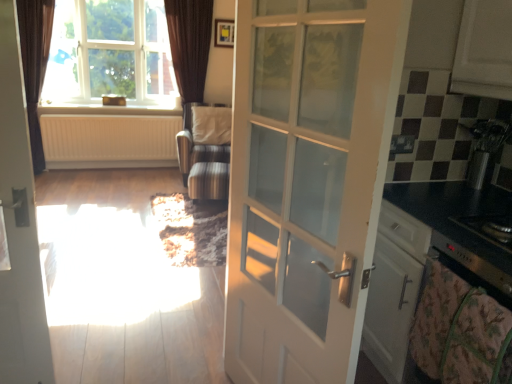
Measure the distance between white glossy door at left, the 1th door in the left-to-right sequence, and camera.

The depth of white glossy door at left, the 1th door in the left-to-right sequence, is 4.37 feet.

What do you see at coordinates (19, 227) in the screenshot? This screenshot has width=512, height=384. I see `white glossy door at left, placed as the 2th door when sorted from right to left` at bounding box center [19, 227].

Measure the distance between striped fabric armchair at center and camera.

The distance of striped fabric armchair at center from camera is 4.01 meters.

Measure the distance between point (x=453, y=343) and camera.

Point (x=453, y=343) and camera are 4.45 feet apart from each other.

The height and width of the screenshot is (384, 512). Identify the location of metallic stainless steel kettle at right, positioned as the 2th appliance in front-to-back order. (485, 148).

The height and width of the screenshot is (384, 512). Describe the element at coordinates (485, 148) in the screenshot. I see `metallic stainless steel kettle at right, which appears as the second appliance when ordered from the bottom` at that location.

Locate an element on the screen. The image size is (512, 384). white matte radiator at upper left is located at coordinates (109, 141).

The width and height of the screenshot is (512, 384). What do you see at coordinates (307, 181) in the screenshot?
I see `white glossy door at center, arranged as the 2th door when viewed from the left` at bounding box center [307, 181].

The width and height of the screenshot is (512, 384). I want to click on white glossy door at left, the 1th door in the left-to-right sequence, so click(x=19, y=227).

From the image's perspective, is white glossy door at center, arranged as the 2th door when viewed from the left, located above striped fabric armchair at center?

Actually, white glossy door at center, arranged as the 2th door when viewed from the left, appears below striped fabric armchair at center in the image.

Is white glossy door at center, which appears as the 1th door when viewed from the right, facing towards striped fabric armchair at center?

No, white glossy door at center, which appears as the 1th door when viewed from the right, is not facing towards striped fabric armchair at center.

Does point (333, 306) come in front of point (191, 155)?

That is True.

Is white glossy door at center, arranged as the 2th door when viewed from the left, not inside striped fabric armchair at center?

white glossy door at center, arranged as the 2th door when viewed from the left, is positioned outside striped fabric armchair at center.

From a real-world perspective, who is located lower, white glossy door at left, placed as the 2th door when sorted from right to left, or white glossy door at center, which appears as the 1th door when viewed from the right?

In real-world perspective, white glossy door at left, placed as the 2th door when sorted from right to left, is lower.

How distant is white glossy door at left, placed as the 2th door when sorted from right to left, from white glossy door at center, arranged as the 2th door when viewed from the left?

The distance of white glossy door at left, placed as the 2th door when sorted from right to left, from white glossy door at center, arranged as the 2th door when viewed from the left, is 37.95 inches.

Find the location of a particular element. This screenshot has width=512, height=384. door located behind the white glossy door at center, arranged as the 2th door when viewed from the left is located at coordinates (19, 227).

How many degrees apart are the facing directions of white glossy door at left, placed as the 2th door when sorted from right to left, and white glossy door at center, arranged as the 2th door when viewed from the left?

There is a 75.2-degree angle between the facing directions of white glossy door at left, placed as the 2th door when sorted from right to left, and white glossy door at center, arranged as the 2th door when viewed from the left.

Where is `door that is the 2nd one when counting leftward from the floral cotton blanket at lower right`? The height and width of the screenshot is (384, 512). door that is the 2nd one when counting leftward from the floral cotton blanket at lower right is located at coordinates (19, 227).

Choose the correct answer: Is white glossy door at left, placed as the 2th door when sorted from right to left, inside floral cotton blanket at lower right or outside it?

white glossy door at left, placed as the 2th door when sorted from right to left, is outside floral cotton blanket at lower right.

Looking at this image, are white glossy door at left, placed as the 2th door when sorted from right to left, and floral cotton blanket at lower right making contact?

No, white glossy door at left, placed as the 2th door when sorted from right to left, is not beside floral cotton blanket at lower right.

Which is nearer, (7, 47) or (474, 316)?

Positioned in front is point (474, 316).

Which of these two, white glossy door at left, placed as the 2th door when sorted from right to left, or white matte cabinet at upper right, is wider?

white matte cabinet at upper right is wider.

Is white matte cabinet at upper right located within white glossy door at left, the 1th door in the left-to-right sequence?

No.

Where is `cabinetry above the white glossy door at left, the 1th door in the left-to-right sequence (from the image's perspective)`? cabinetry above the white glossy door at left, the 1th door in the left-to-right sequence (from the image's perspective) is located at coordinates (484, 50).

Is striped fabric armchair at center bigger than clear glass window at upper left?

Yes.

Between striped fabric armchair at center and clear glass window at upper left, which one appears on the left side from the viewer's perspective?

From the viewer's perspective, clear glass window at upper left appears more on the left side.

Which is correct: striped fabric armchair at center is inside clear glass window at upper left, or outside of it?

striped fabric armchair at center is not enclosed by clear glass window at upper left.

Between floral cotton blanket at lower right and white glossy door at left, the 1th door in the left-to-right sequence, which one appears on the left side from the viewer's perspective?

white glossy door at left, the 1th door in the left-to-right sequence, is more to the left.

From a real-world perspective, is floral cotton blanket at lower right located beneath white glossy door at left, placed as the 2th door when sorted from right to left?

Correct, in the physical world, floral cotton blanket at lower right is lower than white glossy door at left, placed as the 2th door when sorted from right to left.

At what (x,y) coordinates should I click in order to perform the action: click on blanket below the white glossy door at left, placed as the 2th door when sorted from right to left (from the image's perspective). Please return your answer as a coordinate pair (x, y). Looking at the image, I should click on (460, 332).

From the picture: Is floral cotton blanket at lower right positioned with its back to white glossy door at left, the 1th door in the left-to-right sequence?

floral cotton blanket at lower right does not have its back to white glossy door at left, the 1th door in the left-to-right sequence.

Which of these two, white glossy door at left, the 1th door in the left-to-right sequence, or black glass stove at right, the first appliance in the bottom-to-top sequence, is thinner?

With smaller width is white glossy door at left, the 1th door in the left-to-right sequence.

Which is closer to the camera, [44,371] or [483,222]?

Positioned in front is point [483,222].

Which of these two, white glossy door at left, placed as the 2th door when sorted from right to left, or black glass stove at right, the first appliance in the bottom-to-top sequence, is bigger?

white glossy door at left, placed as the 2th door when sorted from right to left.

Measure the distance between white glossy door at left, the 1th door in the left-to-right sequence, and black glass stove at right, arranged as the first appliance when viewed from the front.

They are 1.67 meters apart.

You are a GUI agent. You are given a task and a screenshot of the screen. Output one action in this format:
    pyautogui.click(x=<x>, y=<y>)
    Task: Click on the armchair on the left of the white glossy door at center, arranged as the 2th door when viewed from the left
    This screenshot has width=512, height=384.
    Given the screenshot: What is the action you would take?
    pyautogui.click(x=202, y=162)

Locate an element on the screen. The height and width of the screenshot is (384, 512). door that is in front of the white glossy door at left, placed as the 2th door when sorted from right to left is located at coordinates (307, 181).

Based on their spatial positions, is white glossy door at center, which appears as the 1th door when viewed from the right, or metallic stainless steel kettle at right, acting as the first appliance starting from the top, further from white glossy door at left, placed as the 2th door when sorted from right to left?

metallic stainless steel kettle at right, acting as the first appliance starting from the top, is positioned further to the anchor white glossy door at left, placed as the 2th door when sorted from right to left.

Estimate the real-world distances between objects in this image. Which object is closer to white matte radiator at upper left, metallic stainless steel kettle at right, positioned as the 2th appliance in front-to-back order, or floral cotton blanket at lower right?

metallic stainless steel kettle at right, positioned as the 2th appliance in front-to-back order, is positioned closer to the anchor white matte radiator at upper left.

From the image, which object appears to be farther from brown velvet curtain at upper left, white matte radiator at upper left or striped fabric armchair at center?

Based on the image, striped fabric armchair at center appears to be further to brown velvet curtain at upper left.

When comparing their distances from clear glass window at upper left, does white glossy door at center, arranged as the 2th door when viewed from the left, or metallic stainless steel kettle at right, the 1th appliance viewed from the back, seem closer?

white glossy door at center, arranged as the 2th door when viewed from the left, is positioned closer to the anchor clear glass window at upper left.

Considering their positions, is floral cotton blanket at lower right positioned closer to white glossy door at left, placed as the 2th door when sorted from right to left, than striped fabric armchair at center?

floral cotton blanket at lower right is closer to white glossy door at left, placed as the 2th door when sorted from right to left.

From the picture: Considering their positions, is clear glass window at upper left positioned closer to black glass stove at right, the second appliance when ordered from top to bottom, than white glossy door at left, placed as the 2th door when sorted from right to left?

white glossy door at left, placed as the 2th door when sorted from right to left, is positioned closer to the anchor black glass stove at right, the second appliance when ordered from top to bottom.

Which object lies further to the anchor point white matte radiator at upper left, striped fabric armchair at center or floral cotton blanket at lower right?

floral cotton blanket at lower right is positioned further to the anchor white matte radiator at upper left.

Looking at the image, which one is located closer to striped fabric armchair at center, white matte cabinet at upper right or white matte radiator at upper left?

white matte radiator at upper left is positioned closer to the anchor striped fabric armchair at center.

The height and width of the screenshot is (384, 512). Find the location of `window located between brown velvet curtain at upper left and white matte cabinet at upper right in the left-right direction`. window located between brown velvet curtain at upper left and white matte cabinet at upper right in the left-right direction is located at coordinates (110, 54).

You are a GUI agent. You are given a task and a screenshot of the screen. Output one action in this format:
    pyautogui.click(x=<x>, y=<y>)
    Task: Click on the appliance positioned between black glass stove at right, the first appliance in the bottom-to-top sequence, and white matte radiator at upper left from near to far
    
    Given the screenshot: What is the action you would take?
    pyautogui.click(x=485, y=148)

I want to click on door between black glass stove at right, arranged as the first appliance when viewed from the front, and white matte radiator at upper left, along the z-axis, so click(19, 227).

Image resolution: width=512 pixels, height=384 pixels. Find the location of `appliance positioned between white matte cabinet at upper right and clear glass window at upper left from near to far`. appliance positioned between white matte cabinet at upper right and clear glass window at upper left from near to far is located at coordinates tap(485, 148).